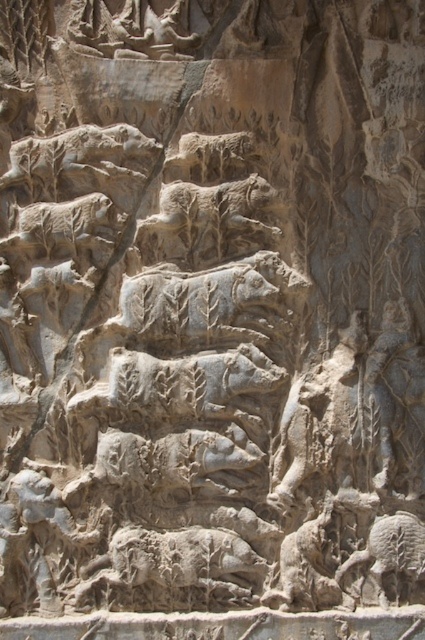
You are an archaeologist examining the ancient stone relief sculpture. You need to determine which animal carving is wider between the gray stone lion at center and the gray stone bear at left. Based on the spatial details, which one is wider?

The gray stone lion at center is wider than the gray stone bear at left according to the description.

You are an archaeologist examining the ancient stone relief sculpture. You notice the gray stone boar at center and the gray stone lion at upper center. Which animal is positioned higher up in the relief?

The gray stone lion at upper center is positioned higher up in the relief than the gray stone boar at center.